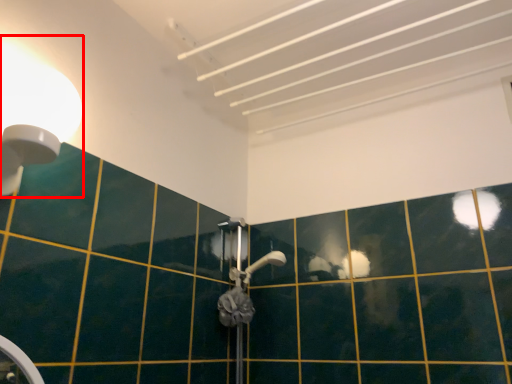
Question: From the image's perspective, what is the correct spatial positioning of light fixture (annotated by the red box) in reference to shower?

Choices:
 (A) below
 (B) above

Answer: (B)